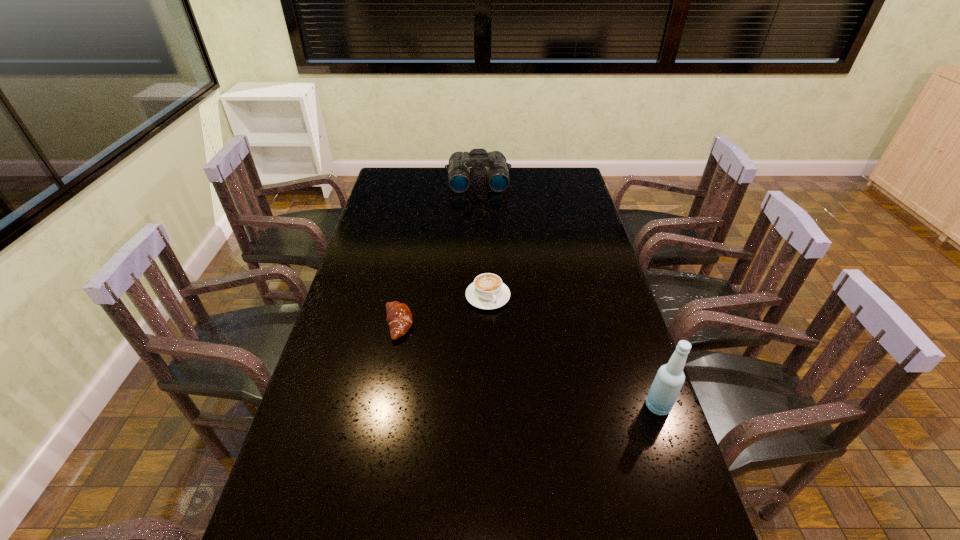
The width and height of the screenshot is (960, 540). Identify the location of free point between the leftmost object and the cappuccino. pyautogui.click(x=443, y=310).

At what (x,y) coordinates should I click in order to perform the action: click on empty space between the rightmost object and the second shortest object. Please return your answer as a coordinate pair (x, y). Looking at the image, I should click on (573, 352).

This screenshot has width=960, height=540. I want to click on vacant region between the rightmost object and the leftmost object, so click(528, 365).

Choose which object is the third nearest neighbor to the farthest object. Please provide its 2D coordinates. Your answer should be formatted as a tuple, i.e. [(x, y)], where the tuple contains the x and y coordinates of a point satisfying the conditions above.

[(670, 377)]

Where is `the second closest object relative to the binoculars`? the second closest object relative to the binoculars is located at coordinates click(399, 318).

The image size is (960, 540). Find the location of `vacant space that satisfies the following two spatial constraints: 1. on the front side of the rightmost object; 2. on the left side of the cappuccino`. vacant space that satisfies the following two spatial constraints: 1. on the front side of the rightmost object; 2. on the left side of the cappuccino is located at coordinates (490, 406).

Where is `free space that satisfies the following two spatial constraints: 1. on the front side of the crescent roll; 2. on the right side of the bottle`? The height and width of the screenshot is (540, 960). free space that satisfies the following two spatial constraints: 1. on the front side of the crescent roll; 2. on the right side of the bottle is located at coordinates click(383, 406).